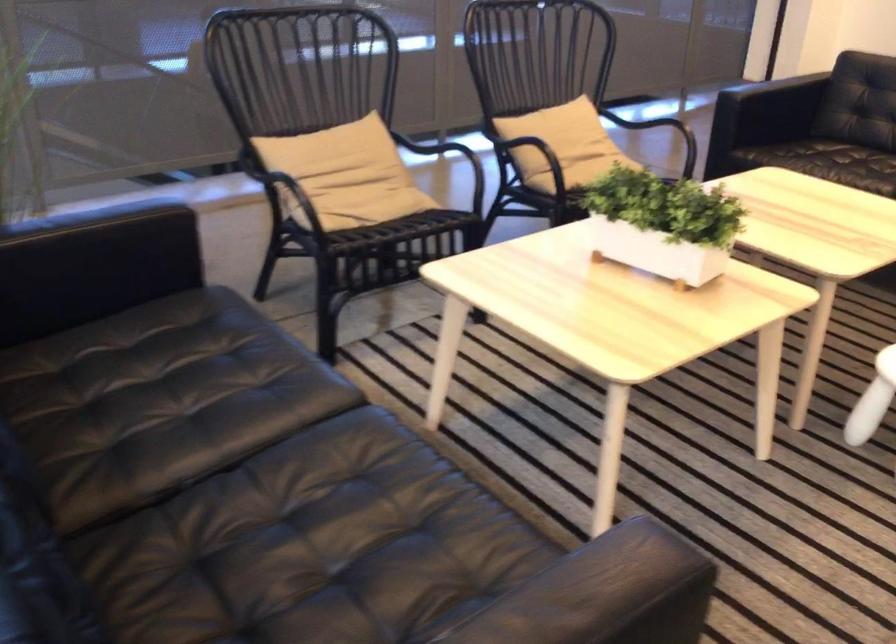
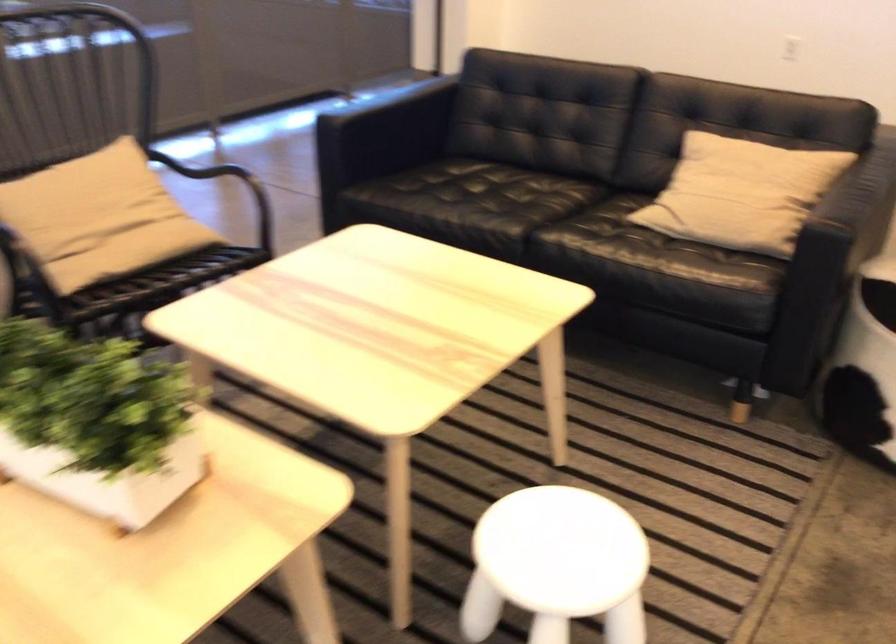
Find the pixel in the second image that matches pixel 606 166 in the first image.

(151, 254)